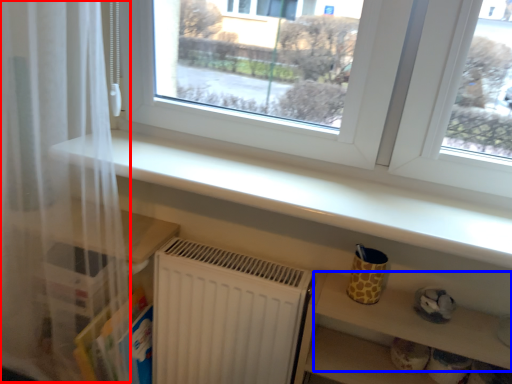
Question: Among these objects, which one is farthest to the camera, curtain (highlighted by a red box) or shelf (highlighted by a blue box)?

Choices:
 (A) curtain
 (B) shelf

Answer: (B)